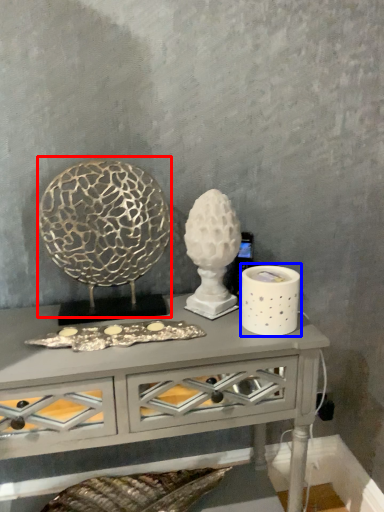
Question: Among these objects, which one is farthest to the camera, sculpture (highlighted by a red box) or candle holder (highlighted by a blue box)?

Choices:
 (A) sculpture
 (B) candle holder

Answer: (B)